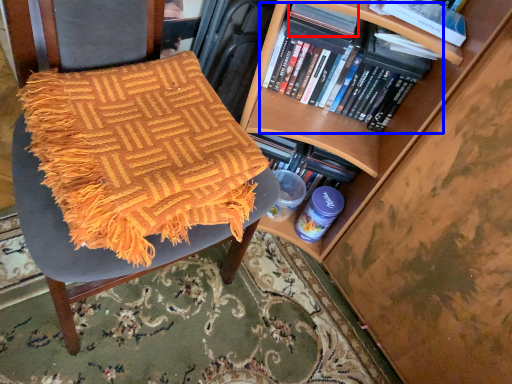
Question: Among these objects, which one is farthest to the camera, paperback book (highlighted by a red box) or book (highlighted by a blue box)?

Choices:
 (A) paperback book
 (B) book

Answer: (B)